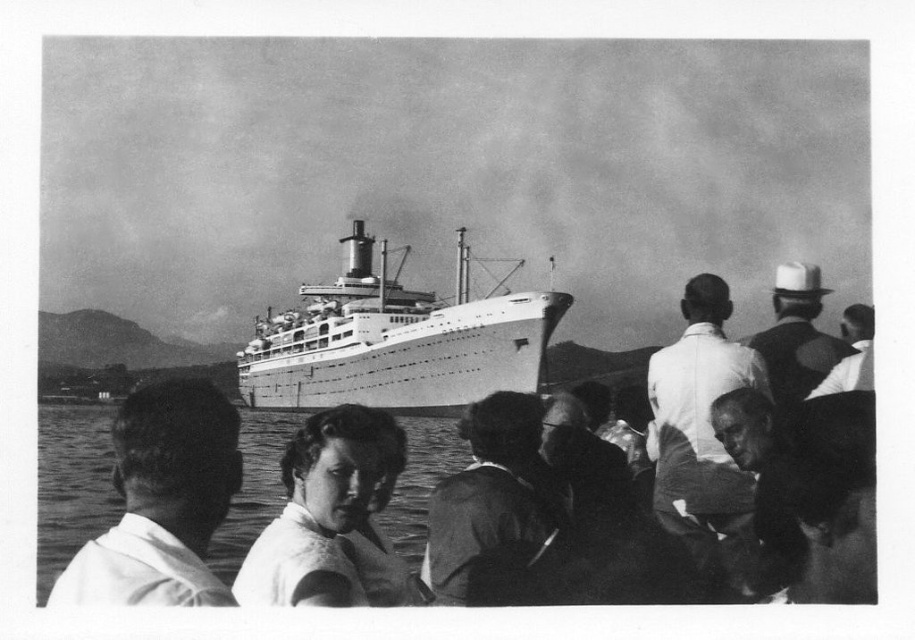
You are standing on the shore and see the clear water at lower center and the smooth white hat at upper right. Which object is closer to the shore?

The clear water at lower center is closer to the shore because it is positioned under the smooth white hat at upper right, indicating it is lower in the scene.

You are standing on the shore and see the clear water at lower center and the smooth white hat at upper right. Which object is closer to your left side?

The clear water at lower center is closer to your left side because it is positioned to the left of the smooth white hat at upper right.